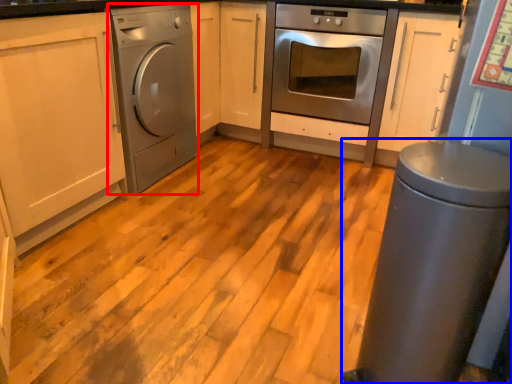
Question: Which of the following is the closest to the observer, home appliance (highlighted by a red box) or gray (highlighted by a blue box)?

Choices:
 (A) home appliance
 (B) gray

Answer: (B)